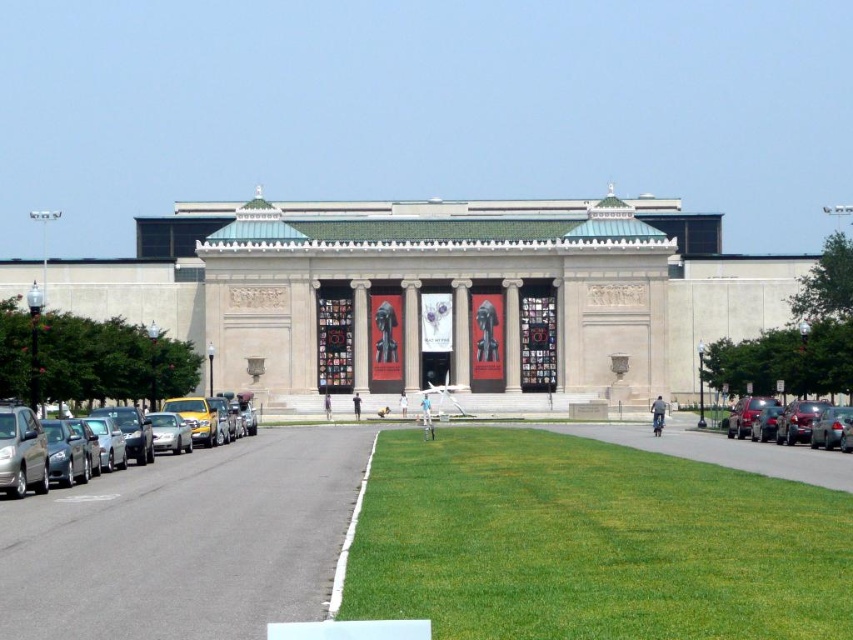
Question: Is green grass at center in front of shiny silver sedan at left?

Choices:
 (A) no
 (B) yes

Answer: (B)

Question: Among these objects, which one is nearest to the camera?

Choices:
 (A) shiny silver sedan at left
 (B) green grass at center

Answer: (B)

Question: Is green grass at center below shiny silver sedan at left?

Choices:
 (A) no
 (B) yes

Answer: (B)

Question: Is green grass at center wider than shiny silver sedan at left?

Choices:
 (A) no
 (B) yes

Answer: (B)